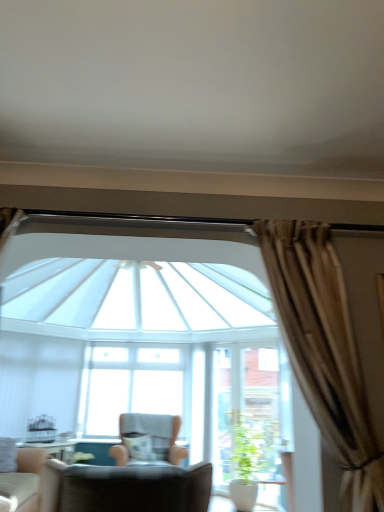
Question: Is light beige fabric chair at lower left, marked as the 2th chair in a back-to-front arrangement, shorter than beige fabric chair at center, the 1th chair when ordered from back to front?

Choices:
 (A) yes
 (B) no

Answer: (A)

Question: Considering the relative sizes of light beige fabric chair at lower left, marked as the 2th chair in a back-to-front arrangement, and beige fabric chair at center, the 3th chair when ordered from front to back, in the image provided, is light beige fabric chair at lower left, marked as the 2th chair in a back-to-front arrangement, wider than beige fabric chair at center, the 3th chair when ordered from front to back,?

Choices:
 (A) no
 (B) yes

Answer: (A)

Question: From a real-world perspective, is light beige fabric chair at lower left, marked as the 2th chair in a back-to-front arrangement, positioned over beige fabric chair at center, the 1th chair when ordered from back to front, based on gravity?

Choices:
 (A) yes
 (B) no

Answer: (A)

Question: Is light beige fabric chair at lower left, marked as the 2th chair in a back-to-front arrangement, at the right side of beige fabric chair at center, the 1th chair when ordered from back to front?

Choices:
 (A) no
 (B) yes

Answer: (A)

Question: Is light beige fabric chair at lower left, marked as the 2th chair in a back-to-front arrangement, bigger than beige fabric chair at center, the 1th chair when ordered from back to front?

Choices:
 (A) yes
 (B) no

Answer: (B)

Question: In terms of width, does leather armchair at lower left, marked as the third chair in a back-to-front arrangement, look wider or thinner when compared to beige fabric chair at center, the 3th chair when ordered from front to back?

Choices:
 (A) wide
 (B) thin

Answer: (B)

Question: Does point (79, 485) appear closer or farther from the camera than point (157, 432)?

Choices:
 (A) closer
 (B) farther

Answer: (A)

Question: From a real-world perspective, is leather armchair at lower left, marked as the third chair in a back-to-front arrangement, physically located above or below beige fabric chair at center, the 3th chair when ordered from front to back?

Choices:
 (A) below
 (B) above

Answer: (B)

Question: Based on their sizes in the image, would you say leather armchair at lower left, the 1th chair in the front-to-back sequence, is bigger or smaller than beige fabric chair at center, the 1th chair when ordered from back to front?

Choices:
 (A) small
 (B) big

Answer: (A)

Question: Is light beige fabric chair at lower left, marked as the 2th chair in a back-to-front arrangement, inside or outside of green matte plant at lower center?

Choices:
 (A) inside
 (B) outside

Answer: (B)

Question: Is point (39, 456) positioned closer to the camera than point (233, 428)?

Choices:
 (A) closer
 (B) farther

Answer: (B)

Question: In terms of height, does light beige fabric chair at lower left, the 2th chair in the front-to-back sequence, look taller or shorter compared to green matte plant at lower center?

Choices:
 (A) tall
 (B) short

Answer: (B)

Question: In the image, is light beige fabric chair at lower left, the 2th chair in the front-to-back sequence, on the left side or the right side of green matte plant at lower center?

Choices:
 (A) right
 (B) left

Answer: (B)

Question: Considering the positions of point (268, 398) and point (165, 355), is point (268, 398) closer or farther from the camera than point (165, 355)?

Choices:
 (A) farther
 (B) closer

Answer: (B)

Question: From their relative heights in the image, would you say white glass screen door at center is taller or shorter than transparent glass window at center?

Choices:
 (A) tall
 (B) short

Answer: (A)